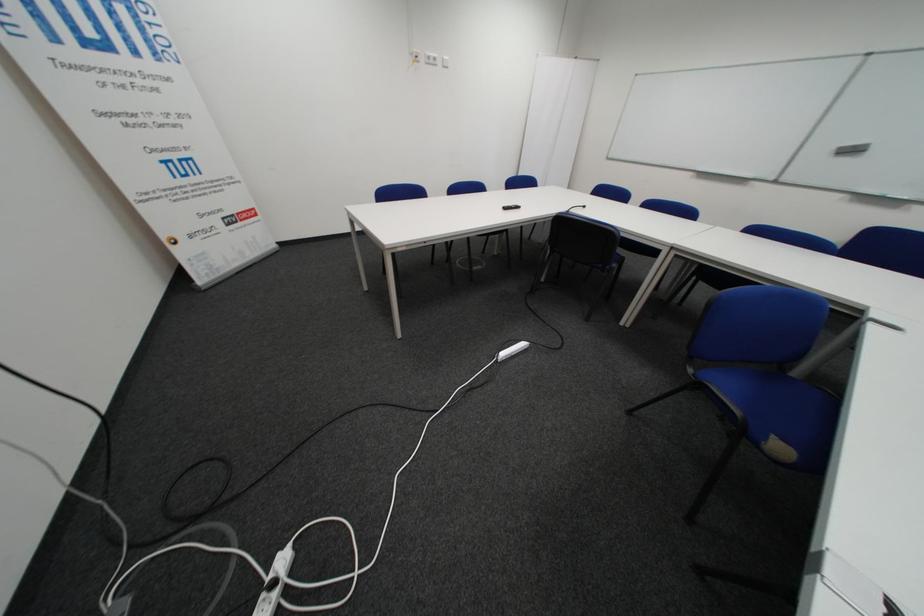
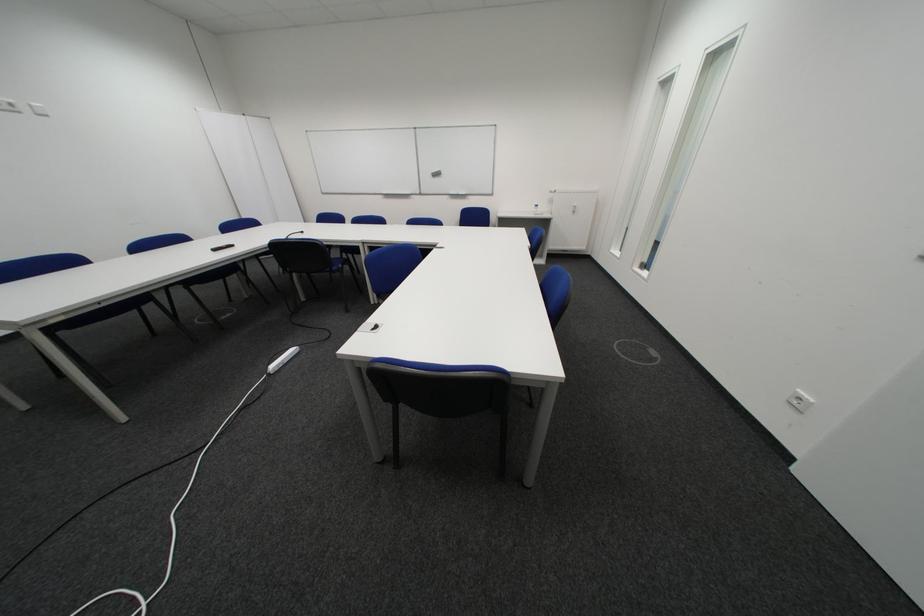
Where in the second image is the point corresponding to point 440,62 from the first image?

(8, 108)